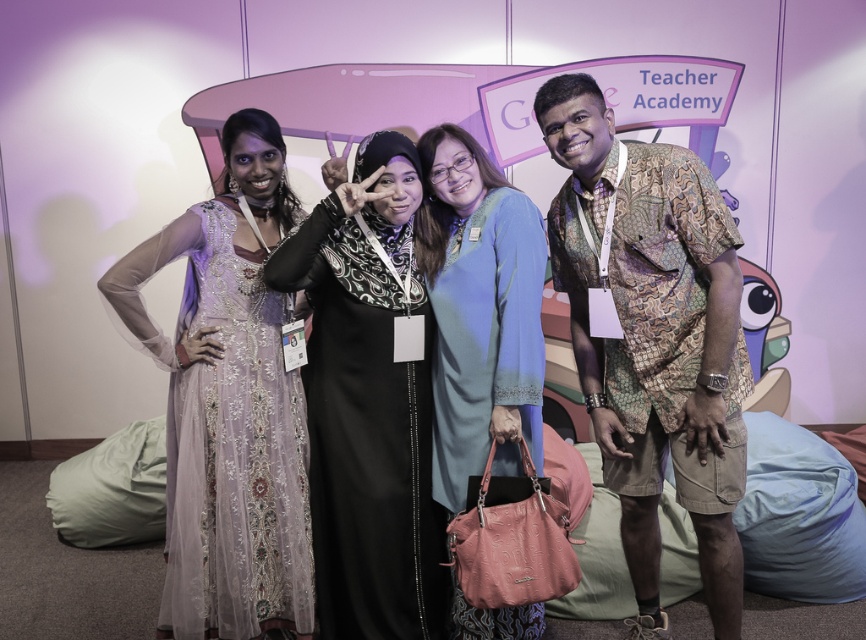
Which is behind, point (391, 141) or point (501, 198)?

Point (501, 198)

Is point (346, 545) farther from camera compared to point (485, 173)?

No, it is not.

I want to click on black satin dress at center, so click(367, 406).

Between lavender sheer dress at left and black satin dress at center, which one is positioned higher?

lavender sheer dress at left is higher up.

You are a GUI agent. You are given a task and a screenshot of the screen. Output one action in this format:
    pyautogui.click(x=<x>, y=<y>)
    Task: Click on the lavender sheer dress at left
    
    Given the screenshot: What is the action you would take?
    pyautogui.click(x=229, y=404)

Where is `lavender sheer dress at left`? The height and width of the screenshot is (640, 866). lavender sheer dress at left is located at coordinates (229, 404).

Does point (661, 442) lie in front of point (514, 378)?

No, it is behind (514, 378).

Locate an element on the screen. batik shirt at right is located at coordinates (653, 339).

Identify the location of batik shirt at right. (653, 339).

Locate an element on the screen. batik shirt at right is located at coordinates (653, 339).